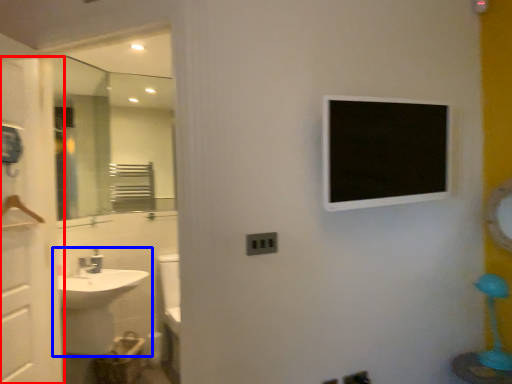
Question: Among these objects, which one is farthest to the camera, screen door (highlighted by a red box) or sink (highlighted by a blue box)?

Choices:
 (A) screen door
 (B) sink

Answer: (B)